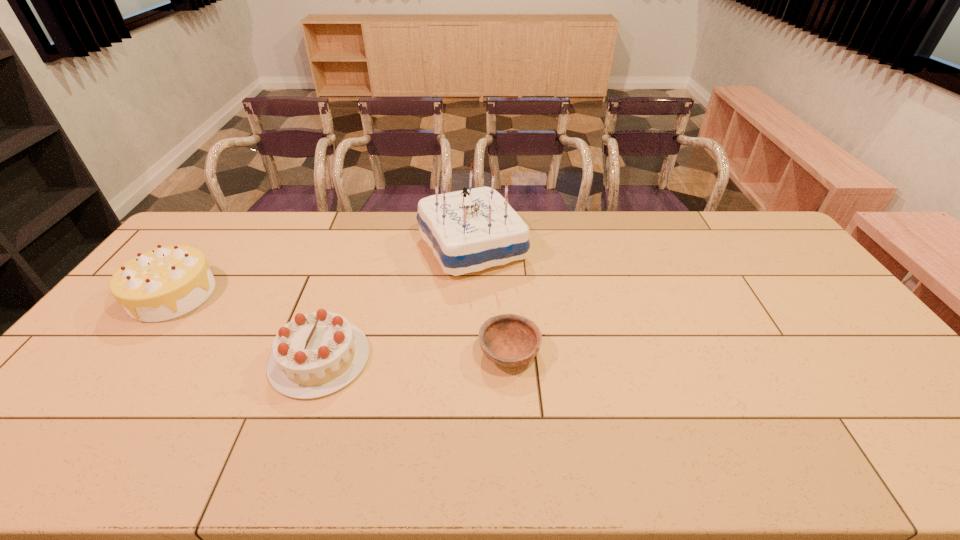
What are the coordinates of `free spot between the third tallest object and the leftmost object` in the screenshot? It's located at (247, 326).

You are a GUI agent. You are given a task and a screenshot of the screen. Output one action in this format:
    pyautogui.click(x=<x>, y=<y>)
    Task: Click on the free space between the shortest object and the second object from left to right
    This screenshot has height=540, width=960.
    Given the screenshot: What is the action you would take?
    [415, 355]

Image resolution: width=960 pixels, height=540 pixels. Identify the location of vacant region between the shortest object and the tallest object. (491, 300).

Image resolution: width=960 pixels, height=540 pixels. In order to click on empty space that is in between the shortest birthday cake and the tallest object in this screenshot , I will do `click(396, 302)`.

Where is `free space between the second birthday cake from right to left and the rightmost birthday cake`? free space between the second birthday cake from right to left and the rightmost birthday cake is located at coordinates (396, 302).

You are a GUI agent. You are given a task and a screenshot of the screen. Output one action in this format:
    pyautogui.click(x=<x>, y=<y>)
    Task: Click on the vacant space in between the tallest object and the third shortest object
    
    Given the screenshot: What is the action you would take?
    pyautogui.click(x=323, y=271)

You are a GUI agent. You are given a task and a screenshot of the screen. Output one action in this format:
    pyautogui.click(x=<x>, y=<y>)
    Task: Click on the object that stands as the closest to the tallest object
    The height and width of the screenshot is (540, 960).
    Given the screenshot: What is the action you would take?
    pyautogui.click(x=316, y=354)

Identify which object is the third nearest to the leftmost object. Please provide its 2D coordinates. Your answer should be formatted as a tuple, i.e. [(x, y)], where the tuple contains the x and y coordinates of a point satisfying the conditions above.

[(509, 340)]

Image resolution: width=960 pixels, height=540 pixels. I want to click on birthday cake that is the third closest to the shortest object, so click(165, 283).

The image size is (960, 540). What are the coordinates of `birthday cake that can be found as the second closest to the shortest object` in the screenshot? It's located at click(316, 354).